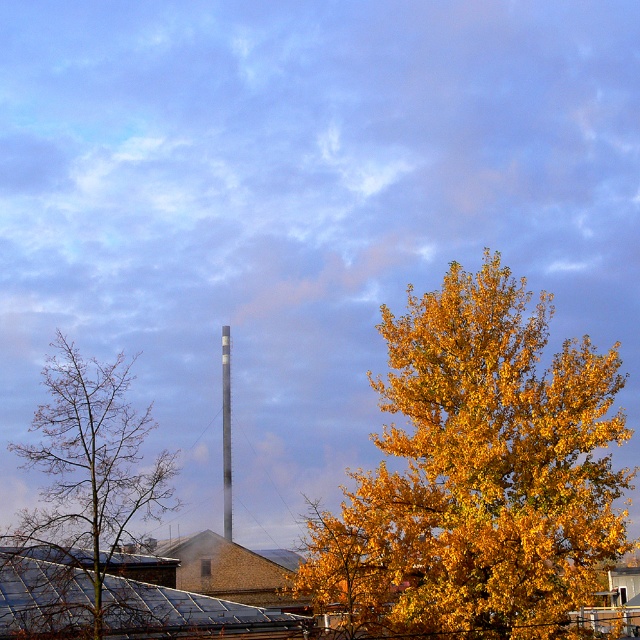
Based on the scene description, where are the golden yellow leaves at center located in the image?

The golden yellow leaves at center are located at point coordinates of approximately 0.742 on the x axis and 0.745 on the y axis.

In the scene shown: You are an artist sketching this scene. You want to ensure the proportions between the bare branches at left and the smooth gray chimney at center are accurate. Which object should you draw wider in your sketch?

The bare branches at left should be drawn wider than the smooth gray chimney at center because the description states that the bare branches at left has a larger width.